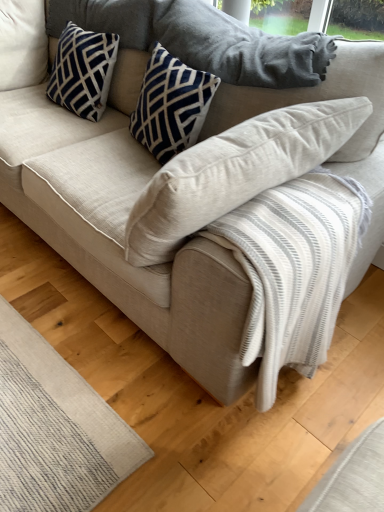
Question: In which direction should I rotate to look at navy velvet pillow at upper center, which is the 2th pillow from left to right?

Choices:
 (A) right
 (B) left

Answer: (B)

Question: Is navy blue printed cushion at upper left, which ranks as the 2th pillow in right-to-left order, thinner than navy velvet pillow at upper center, which is the 2th pillow from left to right?

Choices:
 (A) yes
 (B) no

Answer: (B)

Question: Is navy blue printed cushion at upper left, the 1th pillow when ordered from left to right, far from navy velvet pillow at upper center, which is the 2th pillow from left to right?

Choices:
 (A) yes
 (B) no

Answer: (B)

Question: Is navy blue printed cushion at upper left, which ranks as the 2th pillow in right-to-left order, taller than navy velvet pillow at upper center, positioned as the 1th pillow in right-to-left order?

Choices:
 (A) yes
 (B) no

Answer: (B)

Question: Is navy blue printed cushion at upper left, which ranks as the 2th pillow in right-to-left order, bigger than navy velvet pillow at upper center, positioned as the 1th pillow in right-to-left order?

Choices:
 (A) yes
 (B) no

Answer: (A)

Question: Is navy blue printed cushion at upper left, which ranks as the 2th pillow in right-to-left order, next to navy velvet pillow at upper center, which is the 2th pillow from left to right?

Choices:
 (A) no
 (B) yes

Answer: (A)

Question: Does navy blue printed cushion at upper left, which ranks as the 2th pillow in right-to-left order, appear on the right side of navy velvet pillow at upper center, positioned as the 1th pillow in right-to-left order?

Choices:
 (A) yes
 (B) no

Answer: (B)

Question: Is navy velvet pillow at upper center, which is the 2th pillow from left to right, oriented towards navy blue printed cushion at upper left, the 1th pillow when ordered from left to right?

Choices:
 (A) no
 (B) yes

Answer: (A)

Question: Is navy velvet pillow at upper center, positioned as the 1th pillow in right-to-left order, at the right side of navy blue printed cushion at upper left, which ranks as the 2th pillow in right-to-left order?

Choices:
 (A) no
 (B) yes

Answer: (B)

Question: Are navy velvet pillow at upper center, which is the 2th pillow from left to right, and navy blue printed cushion at upper left, the 1th pillow when ordered from left to right, beside each other?

Choices:
 (A) no
 (B) yes

Answer: (A)

Question: Is navy velvet pillow at upper center, which is the 2th pillow from left to right, positioned beyond the bounds of navy blue printed cushion at upper left, the 1th pillow when ordered from left to right?

Choices:
 (A) no
 (B) yes

Answer: (B)

Question: Is navy blue printed cushion at upper left, the 1th pillow when ordered from left to right, completely or partially inside navy velvet pillow at upper center, which is the 2th pillow from left to right?

Choices:
 (A) no
 (B) yes

Answer: (A)

Question: Is navy velvet pillow at upper center, which is the 2th pillow from left to right, not close to navy blue printed cushion at upper left, which ranks as the 2th pillow in right-to-left order?

Choices:
 (A) yes
 (B) no

Answer: (B)

Question: From a real-world perspective, is navy blue printed cushion at upper left, which ranks as the 2th pillow in right-to-left order, above or below navy velvet pillow at upper center, which is the 2th pillow from left to right?

Choices:
 (A) above
 (B) below

Answer: (B)